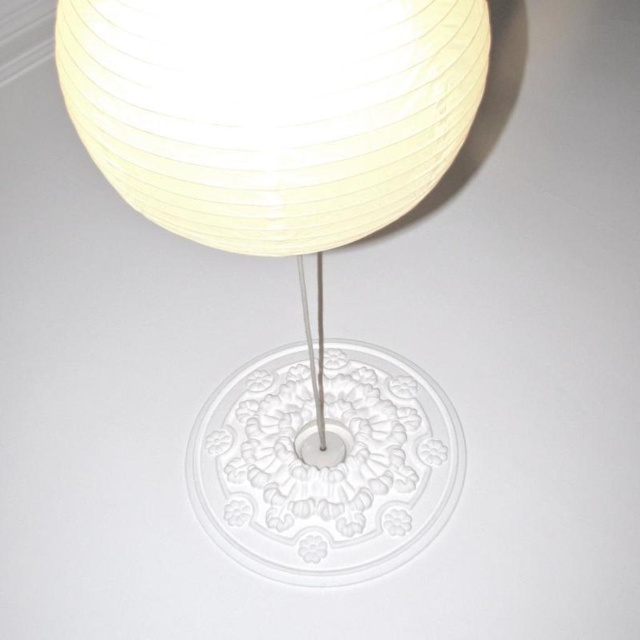
You are looking at a decorative lamp. There are two white paper lampshades in the image. One is labeled as the white paper lampshade at center and the other as the white paper lampshade at upper center. Which lampshade is positioned to the right of the other?

The white paper lampshade at center is positioned to the right of the white paper lampshade at upper center.

You are an interior designer trying to place a new artwork between the white paper lampshade at center and the white paper lampshade at upper center. The artwork is 50 centimeters wide. Will it fit between them?

The distance between the white paper lampshade at center and the white paper lampshade at upper center is 63.23 centimeters. Since the artwork is 50 centimeters wide, it will fit between them as there is enough space.

You are an interior designer planning to place a small decorative item on the table next to the lamp. The item is 10 cm in height. Considering the sizes of the white paper lampshade at center and the white paper lampshade at upper center, which lampshade would be more appropriate to place the item near to maintain visual balance?

The white paper lampshade at center is larger in size than the white paper lampshade at upper center. Therefore, placing the 10 cm decorative item near the larger lampshade would create better visual balance as the item can complement the scale of the larger lampshade without appearing too small or out of proportion.